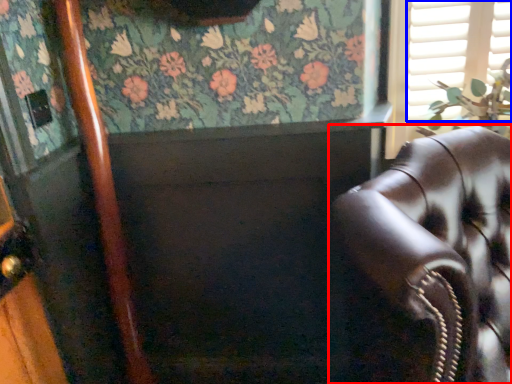
Question: Which object appears farthest to the camera in this image, chair (highlighted by a red box) or shutter (highlighted by a blue box)?

Choices:
 (A) chair
 (B) shutter

Answer: (B)